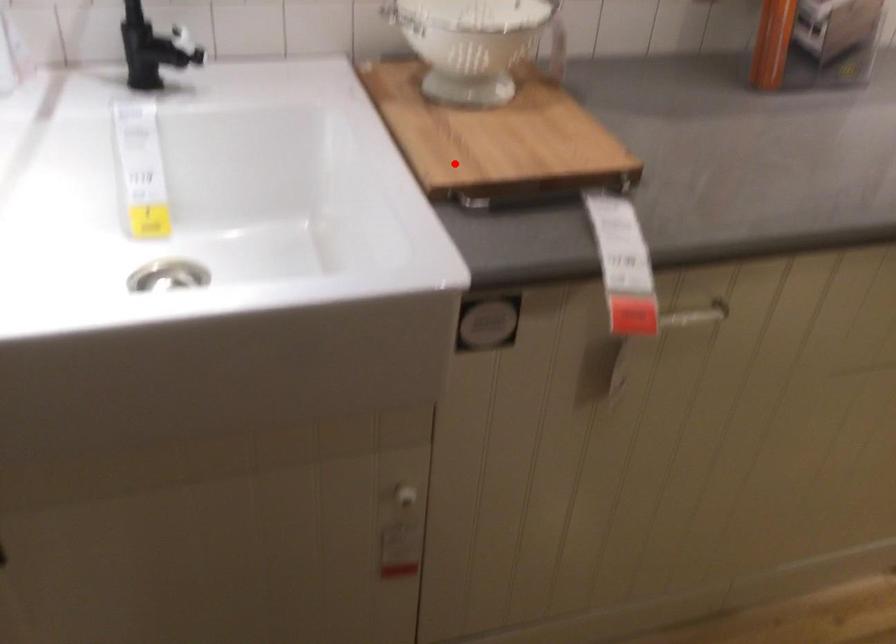
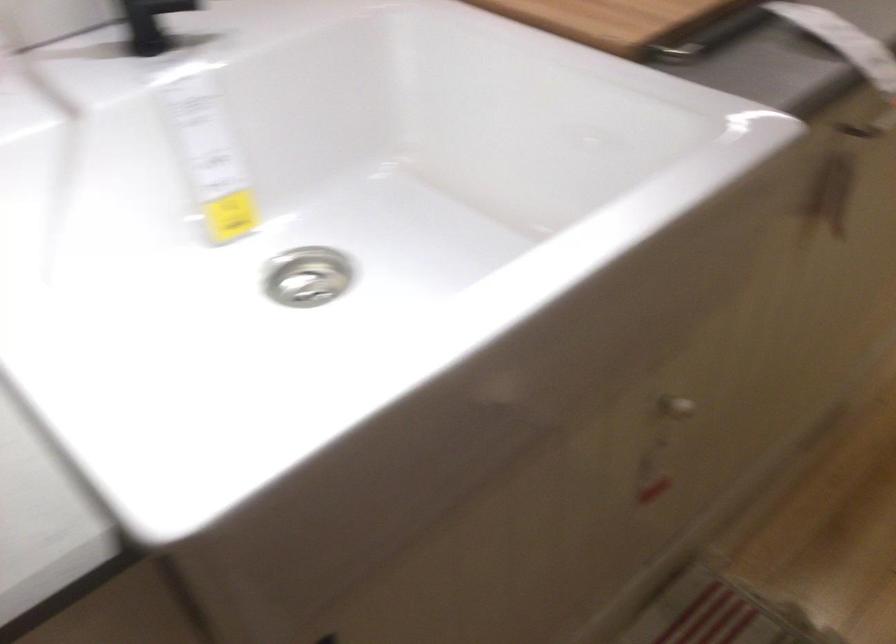
Where in the second image is the point corresponding to the highlighted location from the first image?

(616, 20)